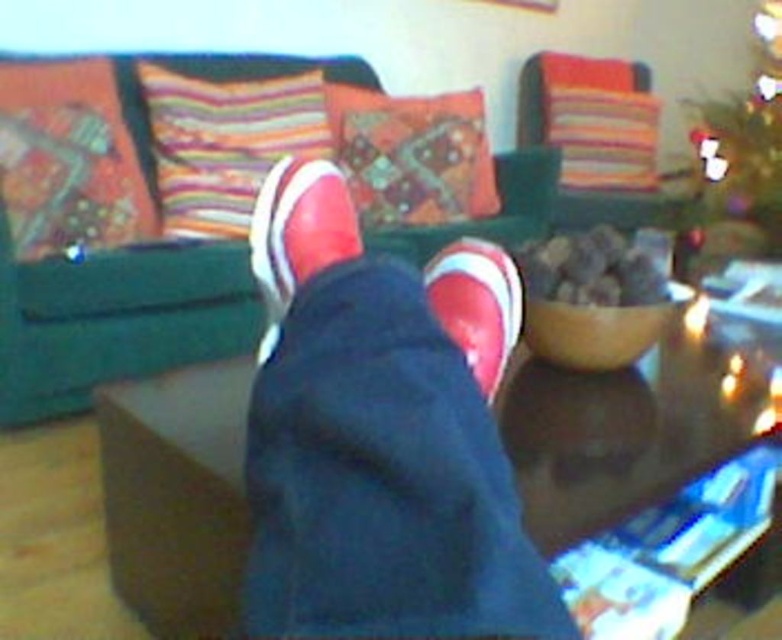
You are standing in the room and want to pick up an object from the table. You notice two points on the table surface. Which point is closer to you, point (709, 188) or point (519, 314)?

Point (519, 314) is closer to you because it is less further to the camera than point (709, 188).

You are standing in a living room and want to reach a point marked at coordinates point [762,113]. If you can walk 5 meters in 1 minute, how long will it take you to reach that point?

The distance of point [762,113] from viewer is 4.30 meters. Since you can walk 5 meters in 1 minute, it will take approximately 0.86 minutes or about 52 seconds to reach the point.

You are standing in a room with a green sofa and a Christmas tree. You see a green textured christmas tree at upper right and a matte white sneaker at center. Which object is positioned to the right of the other?

The green textured christmas tree at upper right is positioned to the right of the matte white sneaker at center.